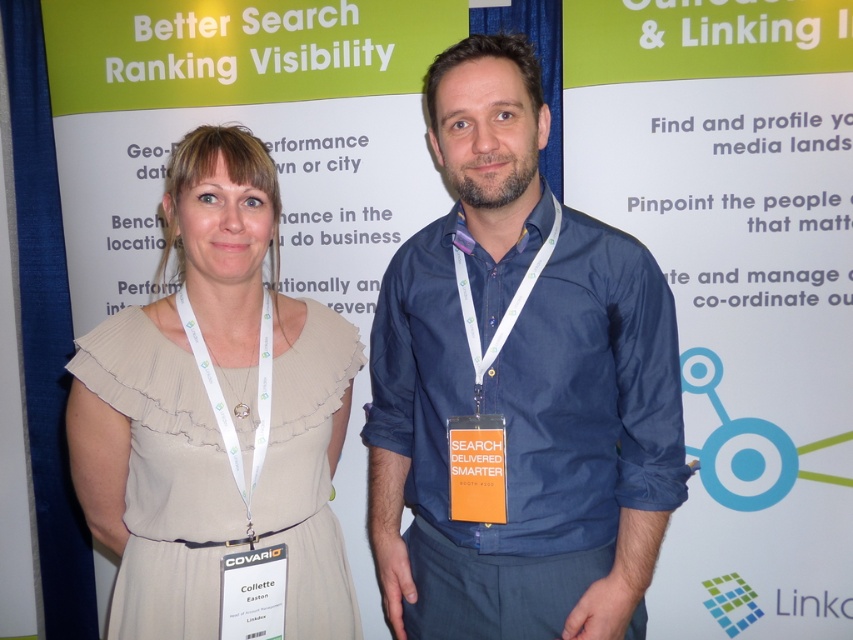
You are attending a conference and see two people standing in front of a promotional backdrop. They are wearing a blue denim shirt at center and a beige chiffon dress at center. Which clothing item is located to the right of the other?

The blue denim shirt at center is positioned on the right side of beige chiffon dress at center.